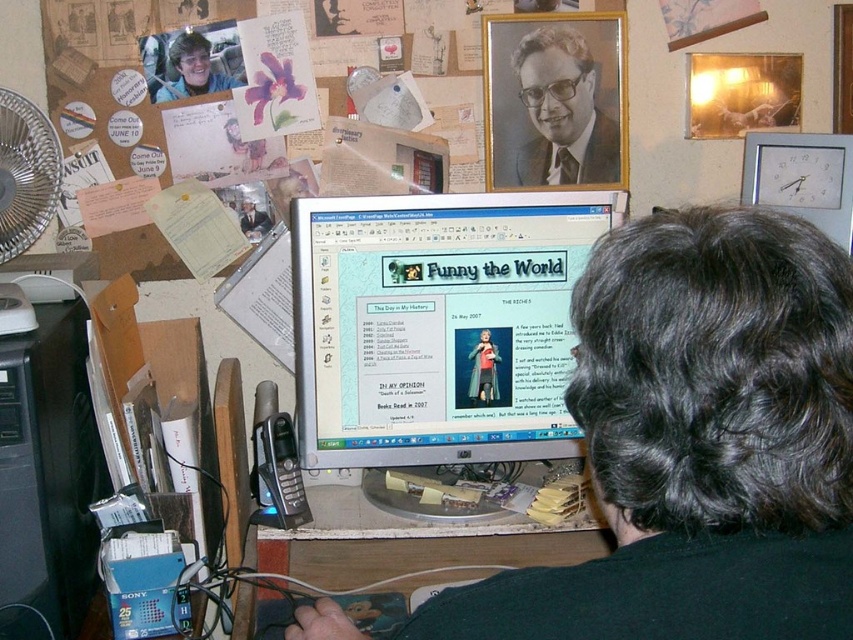
You are organizing items on a desk and need to place the matte black jacket at center and the matte black laptop at center. If the desk is 24 inches wide, will both items fit side by side without overlapping?

The matte black jacket at center is 19.73 inches from the matte black laptop at center. Since the desk is 24 inches wide, both items can fit side by side as the total required space is less than the desk width.

You are organizing items on a desk and need to place both the matte black jacket at center and the matte black laptop at center. Since both are centered, how can you arrange them so they don

The matte black jacket at center is taller than the matte black laptop at center, so you can place the jacket behind the laptop to ensure both are centered while accommodating their size difference.

You are organizing the items on the wall and need to place a new memo between the white plastic clock at upper right and the matte black jacket at center. Based on their positions, where should you place the memo?

The white plastic clock at upper right is to the right of the matte black jacket at center, so you should place the memo between them to the left of the white plastic clock at upper right and to the right of the matte black jacket at center.